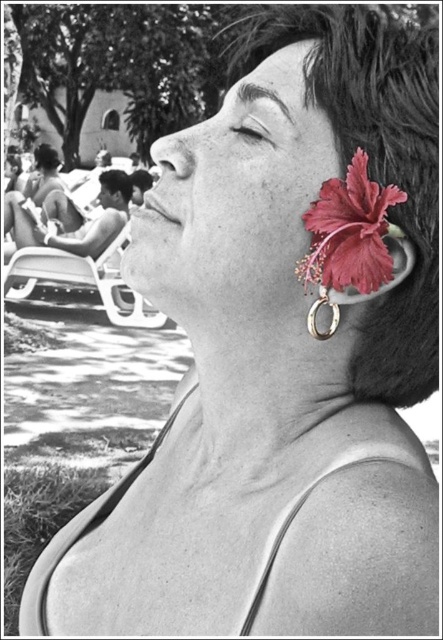
Question: Can you confirm if matte black bikini top at upper left is positioned to the right of black matte hair at upper left?

Choices:
 (A) yes
 (B) no

Answer: (B)

Question: Is dark brown hair at upper right smaller than black matte hair at upper left?

Choices:
 (A) no
 (B) yes

Answer: (B)

Question: Which object appears farthest from the camera in this image?

Choices:
 (A) matte red flower at ear
 (B) dark brown hair at upper left

Answer: (B)

Question: Which object appears farthest from the camera in this image?

Choices:
 (A) black matte hair at upper left
 (B) dark brown hair at upper right
 (C) matte black eye at upper center
 (D) matte red flower at ear

Answer: (A)

Question: Which point is closer to the camera?

Choices:
 (A) [x=349, y=236]
 (B) [x=100, y=198]

Answer: (A)

Question: Can you confirm if matte red flower at ear is positioned to the left of matte black hair at upper left?

Choices:
 (A) no
 (B) yes

Answer: (A)